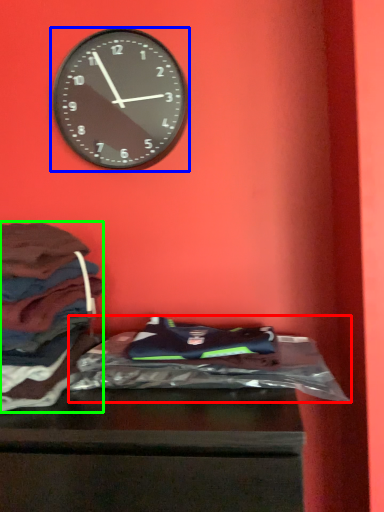
Question: Based on their relative distances, which object is nearer to material (highlighted by a red box)? Choose from wall clock (highlighted by a blue box) and clothing (highlighted by a green box).

Choices:
 (A) wall clock
 (B) clothing

Answer: (B)